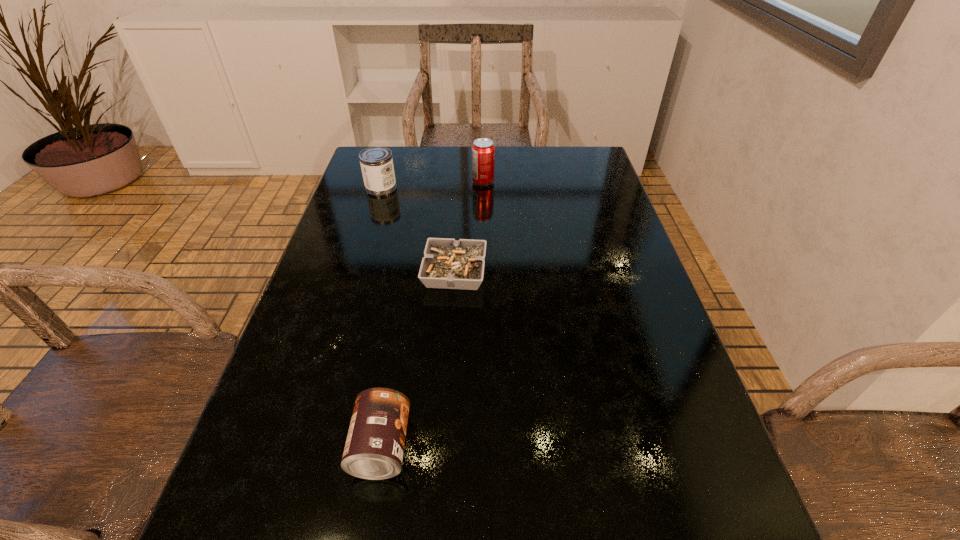
At what (x,y) coordinates should I click in order to perform the action: click on the tallest object. Please return your answer as a coordinate pair (x, y). Image resolution: width=960 pixels, height=540 pixels. Looking at the image, I should click on (483, 151).

Locate an element on the screen. This screenshot has height=540, width=960. the leftmost object is located at coordinates (376, 163).

Locate an element on the screen. the farther can is located at coordinates (376, 163).

In order to click on the shorter can in this screenshot , I will do `click(374, 448)`.

This screenshot has height=540, width=960. What are the coordinates of `the nearest object` in the screenshot? It's located at (374, 448).

The image size is (960, 540). Identify the location of the second nearest object. pyautogui.click(x=448, y=264).

You are a GUI agent. You are given a task and a screenshot of the screen. Output one action in this format:
    pyautogui.click(x=<x>, y=<y>)
    Task: Click on the shortest object
    This screenshot has width=960, height=540.
    Given the screenshot: What is the action you would take?
    pyautogui.click(x=448, y=264)

In order to click on vacant space located 0.240m on the front of the soda in this screenshot , I will do `click(484, 239)`.

The width and height of the screenshot is (960, 540). I want to click on blank area located on the back of the farther can, so click(x=391, y=156).

Locate an element on the screen. This screenshot has width=960, height=540. free space located 0.380m on the front label of the right can is located at coordinates (645, 447).